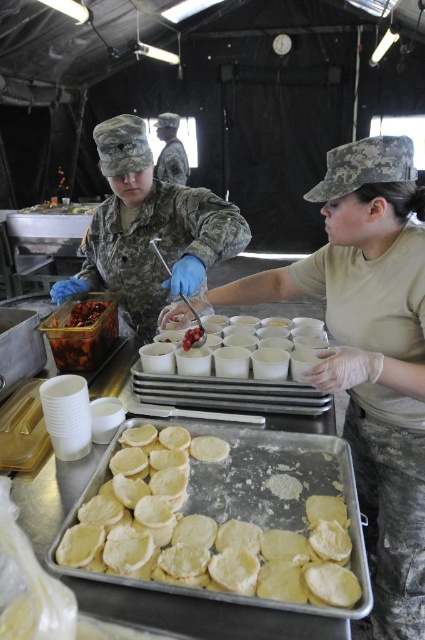
Can you confirm if camouflage fabric uniform at center is shorter than white matte cups at center?

Incorrect, camouflage fabric uniform at center's height does not fall short of white matte cups at center's.

Does camouflage fabric uniform at center have a lesser width compared to white matte cups at center?

No, camouflage fabric uniform at center is not thinner than white matte cups at center.

Measure the distance between point [186,204] and camera.

5.59 feet

I want to click on camouflage fabric uniform at center, so click(159, 248).

Does white matte cups at center appear on the right side of shiny plastic container at center left?

Indeed, white matte cups at center is positioned on the right side of shiny plastic container at center left.

Does white matte cups at center have a greater height compared to shiny plastic container at center left?

No, white matte cups at center is not taller than shiny plastic container at center left.

Where is `white matte cups at center`? This screenshot has width=425, height=640. white matte cups at center is located at coordinates (249, 355).

At what (x,y) coordinates should I click in order to perform the action: click on yellow doughy circles at center. Please return your answer as a coordinate pair (x, y). This screenshot has height=640, width=425. Looking at the image, I should click on (229, 522).